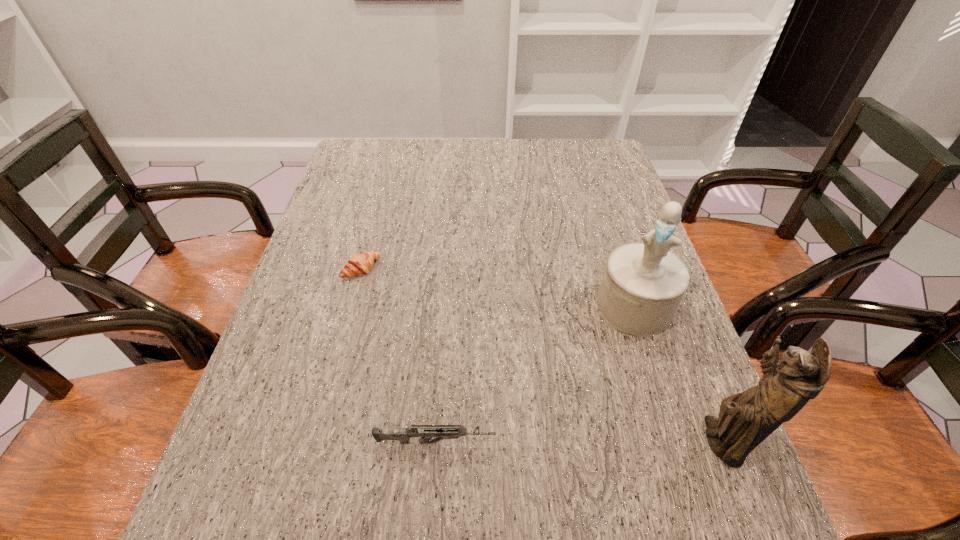
Locate an element on the screen. The width and height of the screenshot is (960, 540). vacant space that's between the third tallest object and the farther figurine is located at coordinates (535, 375).

The height and width of the screenshot is (540, 960). I want to click on unoccupied position between the nearer figurine and the second shortest object, so click(578, 442).

Where is `empty space that is in between the nearer figurine and the farther figurine`? The height and width of the screenshot is (540, 960). empty space that is in between the nearer figurine and the farther figurine is located at coordinates (677, 374).

What are the coordinates of `empty space that is in between the shortest object and the gun` in the screenshot? It's located at (398, 356).

Locate an element on the screen. unoccupied area between the leftmost object and the nearer figurine is located at coordinates (540, 355).

Where is `empty space between the nearer figurine and the shortest object`? This screenshot has width=960, height=540. empty space between the nearer figurine and the shortest object is located at coordinates (540, 355).

At what (x,y) coordinates should I click in order to perform the action: click on free space between the nearer figurine and the second object from left to right. Please return your answer as a coordinate pair (x, y). The image size is (960, 540). Looking at the image, I should click on pyautogui.click(x=578, y=442).

Identify which object is located as the nearest to the nearer figurine. Please provide its 2D coordinates. Your answer should be formatted as a tuple, i.e. [(x, y)], where the tuple contains the x and y coordinates of a point satisfying the conditions above.

[(643, 284)]

Point out which object is positioned as the third nearest to the shortest object. Please provide its 2D coordinates. Your answer should be formatted as a tuple, i.e. [(x, y)], where the tuple contains the x and y coordinates of a point satisfying the conditions above.

[(745, 419)]

This screenshot has width=960, height=540. I want to click on vacant space that satisfies the following two spatial constraints: 1. on the front side of the nearer figurine; 2. on the front-facing side of the farther figurine, so pyautogui.click(x=676, y=441).